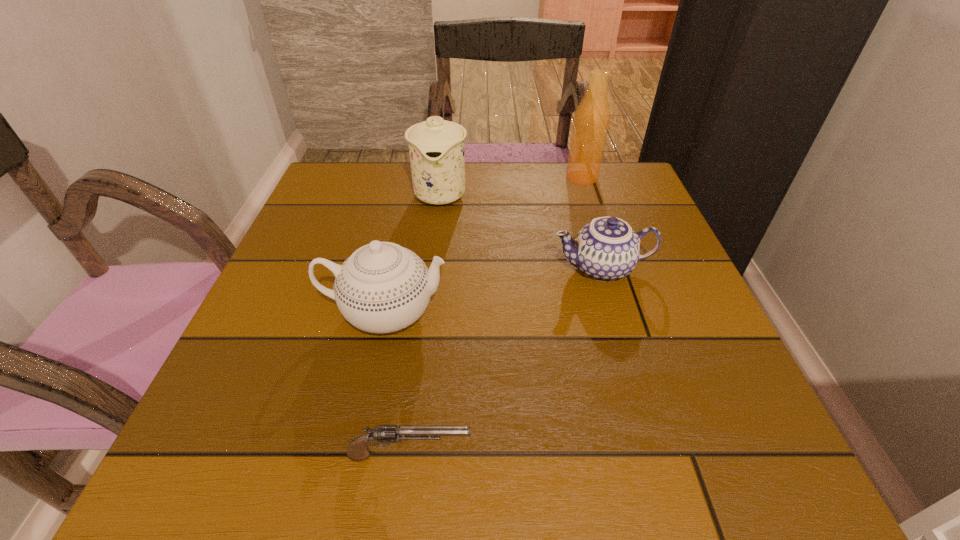
Where is `beer bottle`? beer bottle is located at coordinates (591, 121).

The width and height of the screenshot is (960, 540). I want to click on the farthest chinaware, so click(436, 147).

Locate an element on the screen. This screenshot has height=540, width=960. the second tallest object is located at coordinates (436, 147).

At what (x,y) coordinates should I click in order to perform the action: click on the second tallest chinaware. Please return your answer as a coordinate pair (x, y). The image size is (960, 540). Looking at the image, I should click on (382, 287).

Image resolution: width=960 pixels, height=540 pixels. Find the location of `the shortest chinaware`. the shortest chinaware is located at coordinates (606, 249).

Image resolution: width=960 pixels, height=540 pixels. I want to click on the rightmost chinaware, so click(606, 249).

Where is `gun`? This screenshot has width=960, height=540. gun is located at coordinates (383, 435).

This screenshot has width=960, height=540. I want to click on the nearest object, so click(383, 435).

Locate an element on the screen. The height and width of the screenshot is (540, 960). vacant area located 0.320m on the front of the beer bottle is located at coordinates (612, 271).

Where is `vacant area situated on the spout of the farthest chinaware`? This screenshot has width=960, height=540. vacant area situated on the spout of the farthest chinaware is located at coordinates (432, 264).